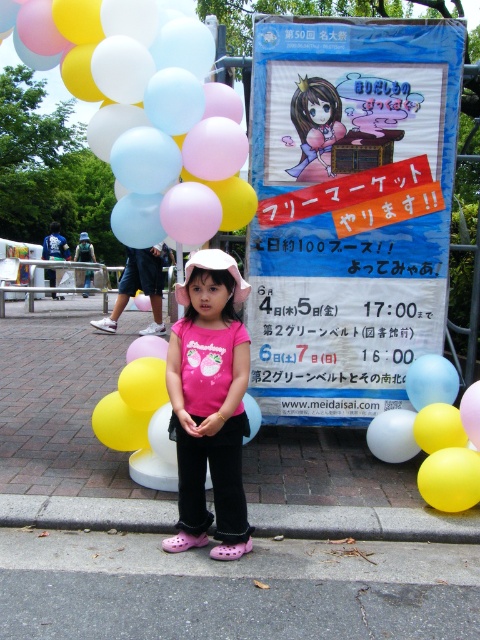
Question: Where is matte balloons at center located in relation to gray concrete curb at lower center in the image?

Choices:
 (A) left
 (B) right

Answer: (A)

Question: Which object appears farthest from the camera in this image?

Choices:
 (A) matte balloons at center
 (B) gray concrete curb at lower center
 (C) pink matte hat at center

Answer: (A)

Question: Which point appears farthest from the camera in this image?

Choices:
 (A) (240, 492)
 (B) (325, 356)
 (C) (144, 168)
 (D) (132, 506)

Answer: (B)

Question: Which point is farther from the camera taking this photo?

Choices:
 (A) (233, 458)
 (B) (75, 522)

Answer: (B)

Question: Does blue paper sign at center appear on the right side of matte balloons at center?

Choices:
 (A) yes
 (B) no

Answer: (A)

Question: Is blue paper sign at center below gray concrete curb at lower center?

Choices:
 (A) yes
 (B) no

Answer: (B)